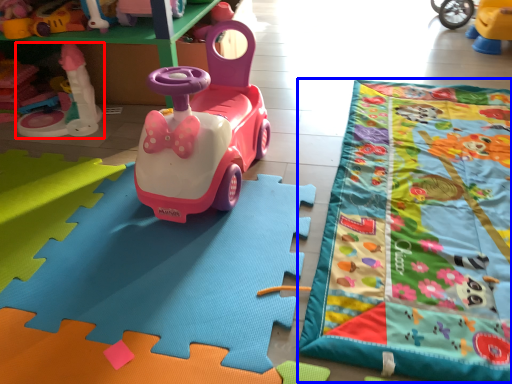
Question: Which object appears farthest to the camera in this image, toy (highlighted by a red box) or blanket (highlighted by a blue box)?

Choices:
 (A) toy
 (B) blanket

Answer: (A)